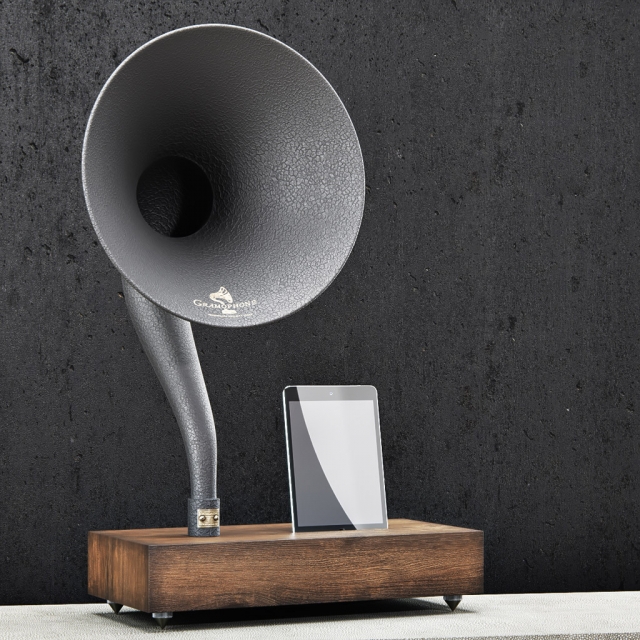
You are a GUI agent. You are given a task and a screenshot of the screen. Output one action in this format:
    pyautogui.click(x=<x>, y=<y>)
    Task: Click on the black spots on wall
    This screenshot has height=640, width=640.
    Given the screenshot: What is the action you would take?
    pyautogui.click(x=504, y=152), pyautogui.click(x=492, y=385), pyautogui.click(x=80, y=484), pyautogui.click(x=52, y=323), pyautogui.click(x=45, y=82), pyautogui.click(x=93, y=16)